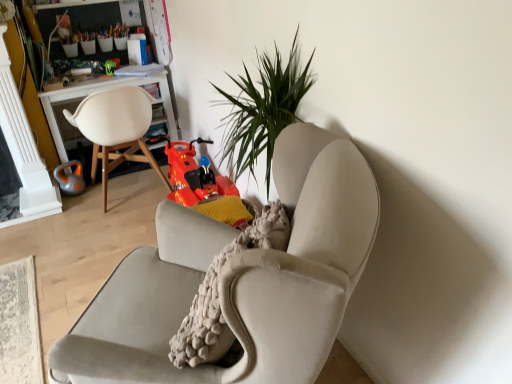
Where is `free area in between orange rubber kettlebell at left, marked as the second toy in a right-to-left arrangement, and white matte chair at left, which is counted as the 1th chair, starting from the left`? The height and width of the screenshot is (384, 512). free area in between orange rubber kettlebell at left, marked as the second toy in a right-to-left arrangement, and white matte chair at left, which is counted as the 1th chair, starting from the left is located at coordinates (88, 204).